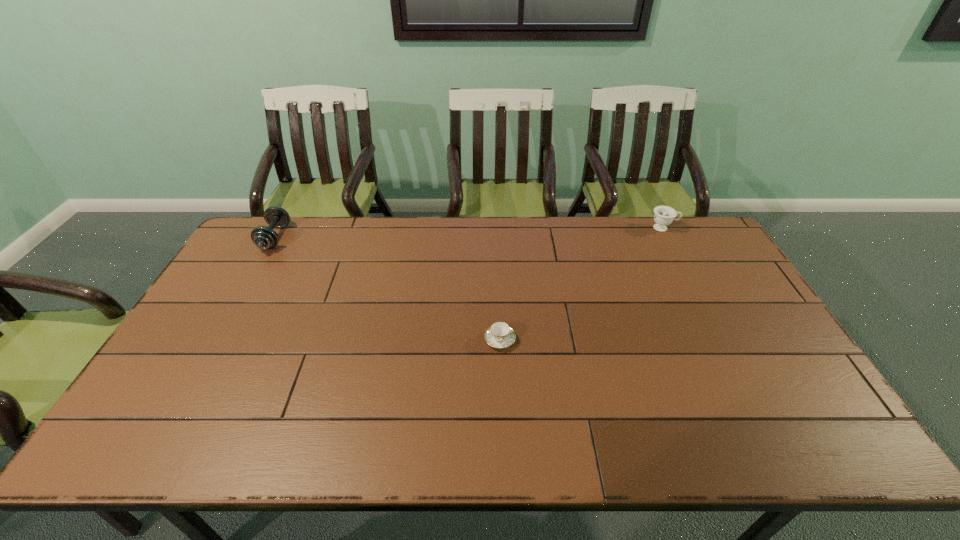
The width and height of the screenshot is (960, 540). Identify the location of dumbbell. (263, 237).

This screenshot has width=960, height=540. Find the location of `the tallest object`. the tallest object is located at coordinates (263, 237).

The height and width of the screenshot is (540, 960). Identify the location of the rightmost object. (664, 215).

Locate an element on the screen. the right teacup is located at coordinates (664, 215).

You are a GUI agent. You are given a task and a screenshot of the screen. Output one action in this format:
    pyautogui.click(x=<x>, y=<y>)
    Task: Click on the nearer teacup
    The image size is (960, 540).
    Given the screenshot: What is the action you would take?
    pyautogui.click(x=499, y=335)

You are a GUI agent. You are given a task and a screenshot of the screen. Output one action in this format:
    pyautogui.click(x=<x>, y=<y>)
    Task: Click on the second object from right to left
    The height and width of the screenshot is (540, 960).
    Given the screenshot: What is the action you would take?
    pyautogui.click(x=499, y=335)

Find the location of a particular element. The width and height of the screenshot is (960, 540). vacant space located 0.300m on the front of the dumbbell is located at coordinates (227, 322).

What are the coordinates of `free spot located on the side of the taller teacup with the handle` in the screenshot? It's located at (705, 228).

This screenshot has width=960, height=540. I want to click on vacant position located on the side with the handle of the nearer teacup, so click(501, 377).

Locate an element on the screen. Image resolution: width=960 pixels, height=540 pixels. dumbbell present at the far edge is located at coordinates (263, 237).